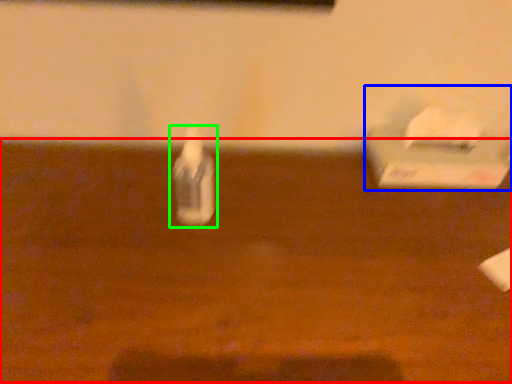
Question: Estimate the real-world distances between objects in this image. Which object is farther from table (highlighted by a red box), box (highlighted by a blue box) or bottle (highlighted by a green box)?

Choices:
 (A) box
 (B) bottle

Answer: (A)